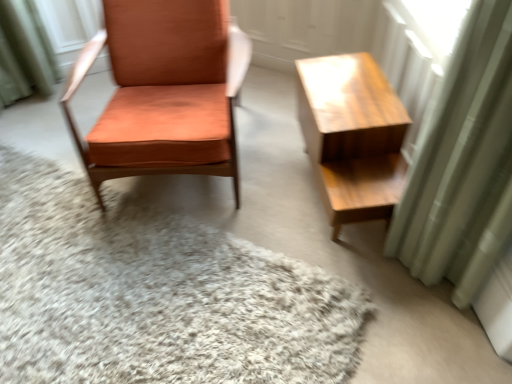
Question: Considering the relative sizes of green fabric curtain at right and white shaggy rug at center in the image provided, is green fabric curtain at right bigger than white shaggy rug at center?

Choices:
 (A) yes
 (B) no

Answer: (B)

Question: Is green fabric curtain at right wider than white shaggy rug at center?

Choices:
 (A) yes
 (B) no

Answer: (B)

Question: Is green fabric curtain at right facing away from white shaggy rug at center?

Choices:
 (A) yes
 (B) no

Answer: (B)

Question: Considering the relative sizes of green fabric curtain at right and white shaggy rug at center in the image provided, is green fabric curtain at right smaller than white shaggy rug at center?

Choices:
 (A) yes
 (B) no

Answer: (A)

Question: Can you confirm if green fabric curtain at right is shorter than white shaggy rug at center?

Choices:
 (A) no
 (B) yes

Answer: (A)

Question: Is green fabric curtain at right in front of or behind orange leather chair at left in the image?

Choices:
 (A) front
 (B) behind

Answer: (A)

Question: From their relative heights in the image, would you say green fabric curtain at right is taller or shorter than orange leather chair at left?

Choices:
 (A) short
 (B) tall

Answer: (B)

Question: From a real-world perspective, relative to orange leather chair at left, is green fabric curtain at right vertically above or below?

Choices:
 (A) above
 (B) below

Answer: (A)

Question: Considering the positions of point (456, 225) and point (142, 9), is point (456, 225) closer or farther from the camera than point (142, 9)?

Choices:
 (A) farther
 (B) closer

Answer: (B)

Question: From a real-world perspective, relative to orange leather chair at left, is white shaggy rug at center vertically above or below?

Choices:
 (A) below
 (B) above

Answer: (A)

Question: From the image's perspective, relative to orange leather chair at left, is white shaggy rug at center above or below?

Choices:
 (A) below
 (B) above

Answer: (A)

Question: In terms of height, does white shaggy rug at center look taller or shorter compared to orange leather chair at left?

Choices:
 (A) tall
 (B) short

Answer: (B)

Question: Is point (93, 334) positioned closer to the camera than point (173, 114)?

Choices:
 (A) farther
 (B) closer

Answer: (B)

Question: In terms of height, does light brown wood table at right look taller or shorter compared to green fabric curtain at right?

Choices:
 (A) short
 (B) tall

Answer: (A)

Question: Is light brown wood table at right wider or thinner than green fabric curtain at right?

Choices:
 (A) thin
 (B) wide

Answer: (B)